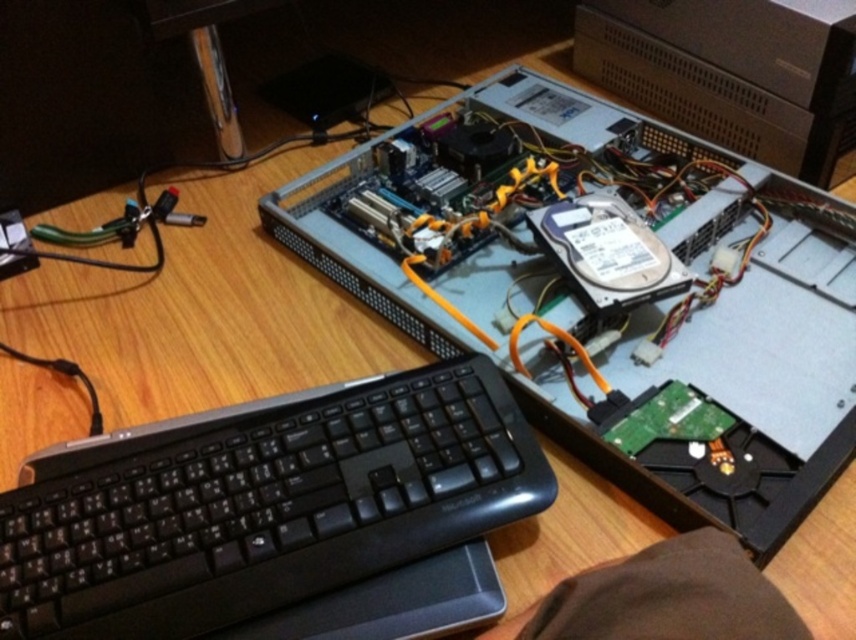
You are setting up a new desk setup and want to place the black plastic keyboard at lower left and the sleek silver desktop at upper center. Given their sizes, which object should you prioritize placing first to ensure proper spacing?

The black plastic keyboard at lower left is smaller than the sleek silver desktop at upper center. Therefore, you should prioritize placing the sleek silver desktop at upper center first to accommodate its larger size and ensure there is enough space left for the smaller keyboard.

You are looking at the workspace and want to place a small tool between the two points, point (415, 612) and point (830, 128). Which point should you place it closer to in order for it to be closer to you?

You should place the tool closer to point (415, 612) because it is closer to the viewer than point (830, 128).